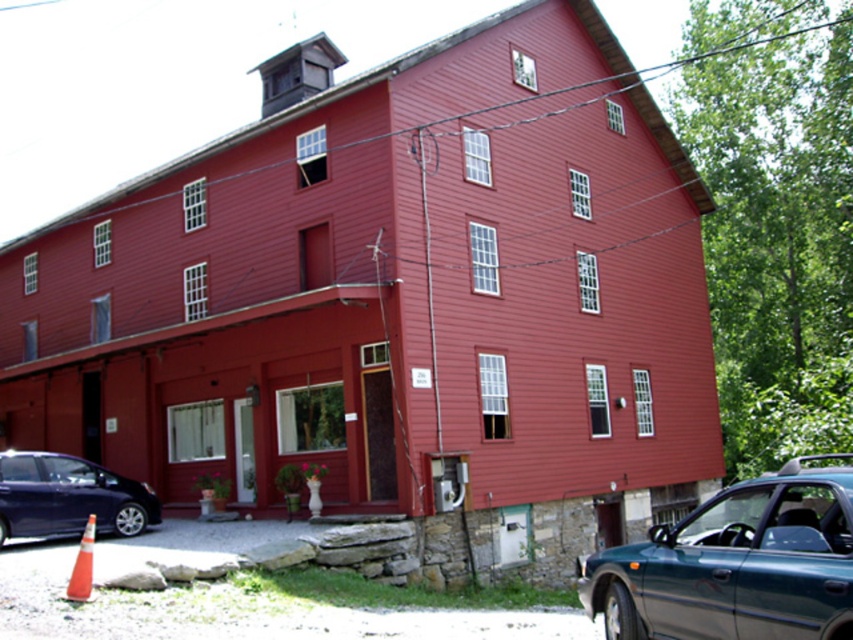
Looking at this image, you are a visitor arriving at the red building and see the green matte car at lower right and the metallic blue car at lower left. Which car is parked closer to the entrance of the building?

The green matte car at lower right is parked closer to the entrance of the building because it is positioned under the metallic blue car at lower left, indicating it is in front and thus nearer to the entrance.

You are standing at the entrance of the red building and want to park your car in the parking lot behind the building. The parking lot is located at point (735, 564). However, there is an object at that point. What is the object blocking the parking space at point 0.884, 0.864?

The object blocking the parking space at point (735, 564) is the green matte car at lower right.